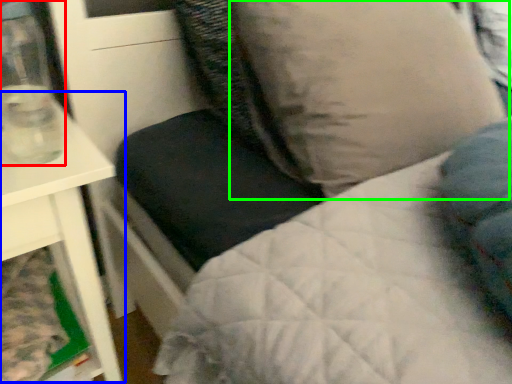
Question: Considering the real-world distances, which object is farthest from glass vase (highlighted by a red box)? table (highlighted by a blue box) or pillow (highlighted by a green box)?

Choices:
 (A) table
 (B) pillow

Answer: (B)